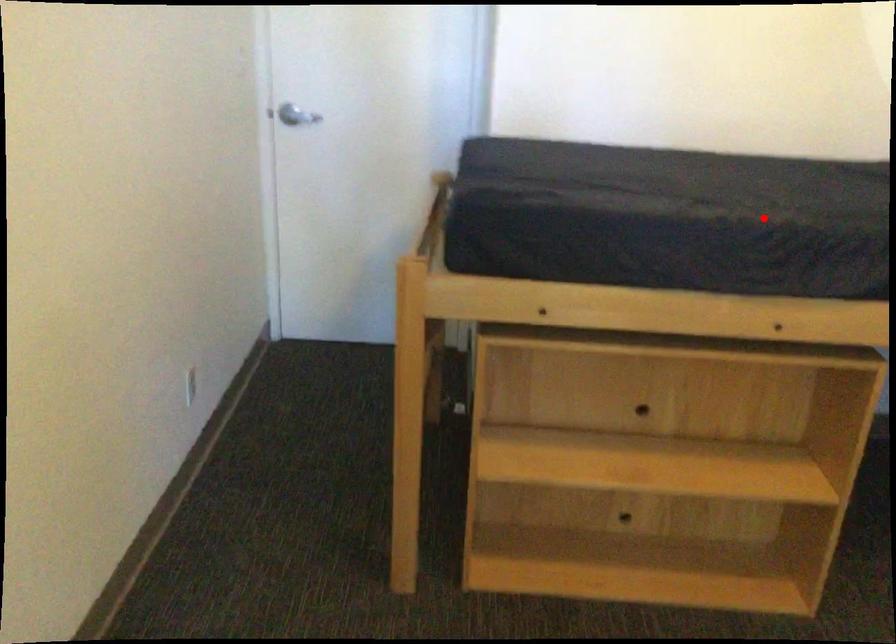
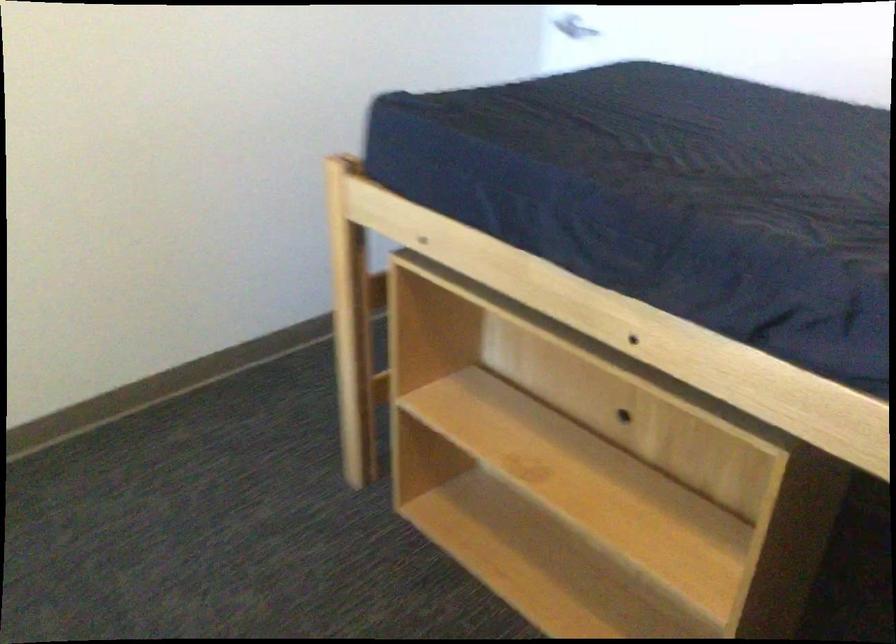
Question: A red point is marked in image1. In image2, is the corresponding 3D point closer to the camera or farther? Reply with the corresponding letter.

Choices:
 (A) The corresponding 3D point is closer.
 (B) The corresponding 3D point is farther.

Answer: (A)